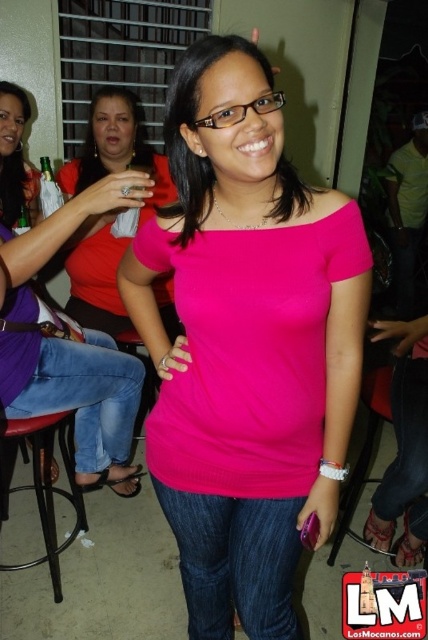
You are organizing a charity event and need to arrange two items on a narrow shelf. The items are the matte red blouse at upper left and the jeans at center. Which item should you place first to ensure they both fit on the shelf?

The jeans at center should be placed first since the matte red blouse at upper left might be wider and could take up more space if placed later, potentially causing overcrowding.

You are standing at point [421,483] and want to move to point [128,136]. Is the path clear of obstacles between these two points?

Point [128,136] is behind point [421,483], so the path between them is blocked by the objects at point [421,483].